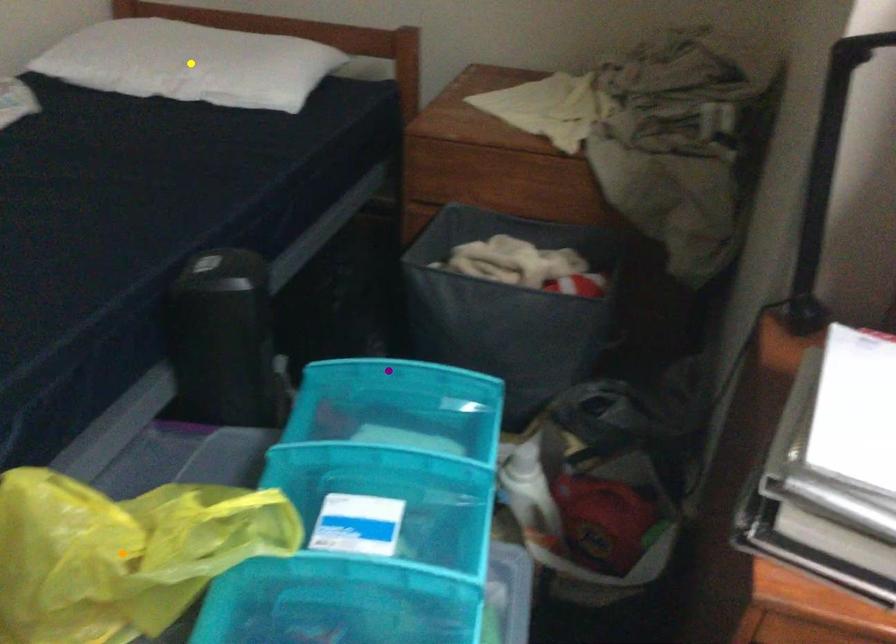
Consider the image. Order these from nearest to farthest:
purple point
yellow point
orange point

orange point < purple point < yellow point